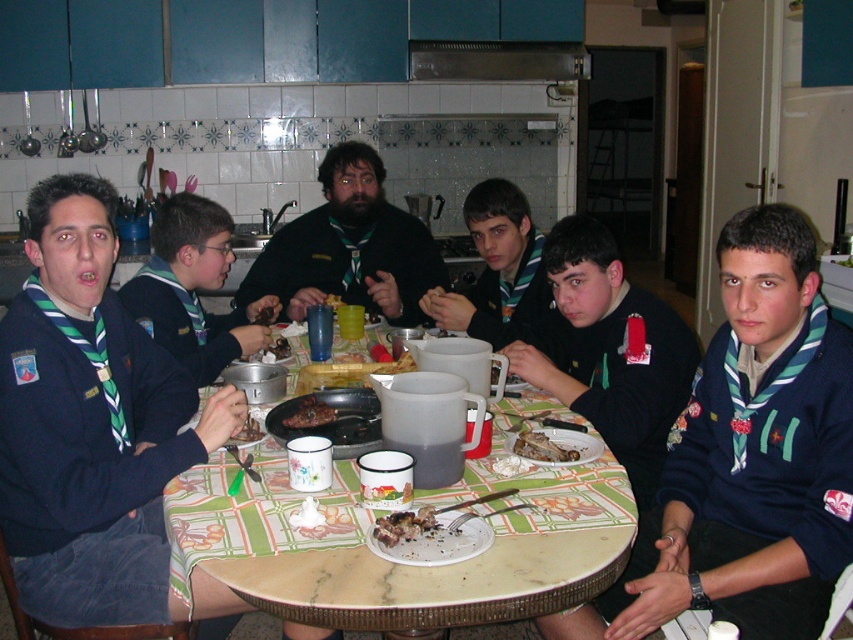
You are a member of the group seated around the table. You want to place an additional plate on the table without moving any existing items. Is there enough space near the crumbly brown bread at table center and the yellow matte plastic cup at center to accommodate the plate?

The crumbly brown bread at table center occupies less space than the yellow matte plastic cup at center, so there might be enough space near the bread to place the plate, but the cup takes up more space, so placing the plate near it may be challenging.

Looking at this image, you are standing at the point labeled point [258,285] and want to move to the point labeled point [549,605]. Which direction should you move to reach your destination?

You should move forward because point [549,605] is in front of point [258,285].